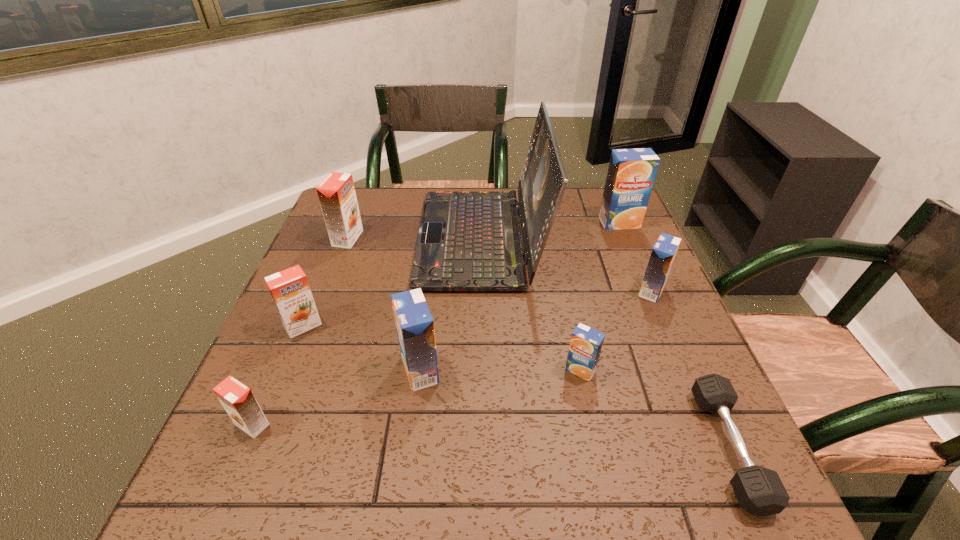
Locate an element on the screen. The width and height of the screenshot is (960, 540). the third blue orange_juice from right to left is located at coordinates (586, 343).

Where is `the smallest blue orange_juice`? This screenshot has height=540, width=960. the smallest blue orange_juice is located at coordinates (586, 343).

At what (x,y) coordinates should I click in order to perform the action: click on the nearest orange orange juice. Please return your answer as a coordinate pair (x, y). The image size is (960, 540). Looking at the image, I should click on (237, 399).

This screenshot has width=960, height=540. In order to click on the nearest orange juice in this screenshot , I will do `click(237, 399)`.

The image size is (960, 540). In order to click on the shortest object in this screenshot , I will do `click(760, 491)`.

Identify the location of free space located on the screen of the laptop computer. The image size is (960, 540). (395, 239).

I want to click on vacant space located on the screen of the laptop computer, so click(x=344, y=239).

Identify the location of free point located on the screen of the laptop computer. This screenshot has width=960, height=540. (401, 239).

Where is `free space located 0.110m on the back of the farthest blue orange_juice`? free space located 0.110m on the back of the farthest blue orange_juice is located at coordinates (609, 197).

Where is `free space located on the right of the biggest orange orange juice`? free space located on the right of the biggest orange orange juice is located at coordinates (478, 238).